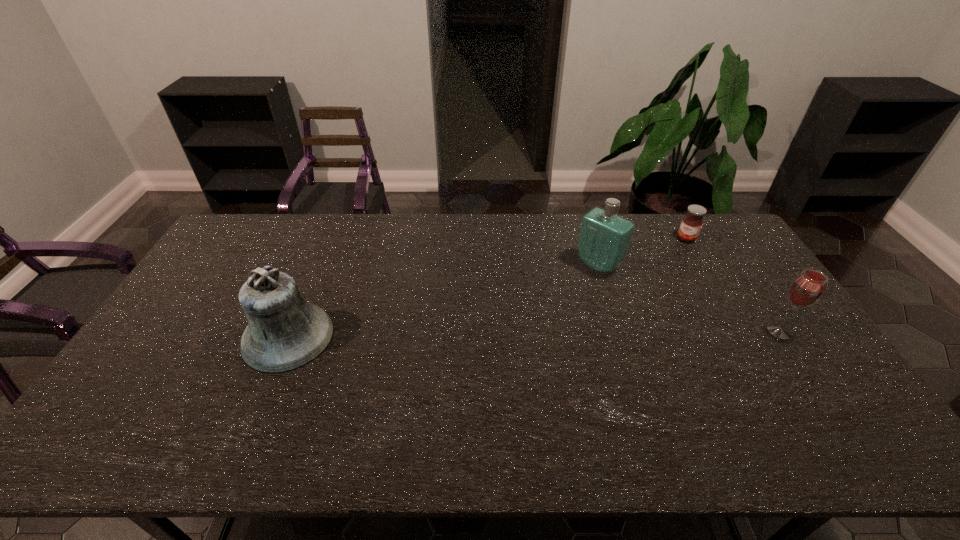
This screenshot has width=960, height=540. Find the location of `vacant space at the far edge of the desktop`. vacant space at the far edge of the desktop is located at coordinates (382, 233).

You are a GUI agent. You are given a task and a screenshot of the screen. Output one action in this format:
    pyautogui.click(x=<x>, y=<y>)
    Task: Click on the free location at the near edge of the desktop
    The width and height of the screenshot is (960, 540).
    Given the screenshot: What is the action you would take?
    pyautogui.click(x=469, y=408)

Image resolution: width=960 pixels, height=540 pixels. Identify the location of vacant space at the left edge of the desktop. (183, 360).

I want to click on free space at the far left corner, so click(232, 247).

In the image, there is a desktop. At what (x,y) coordinates should I click in order to perform the action: click on blank space at the near left corner. Please return your answer as a coordinate pair (x, y). This screenshot has width=960, height=540. Looking at the image, I should click on (156, 388).

In the image, there is a desktop. Where is `vacant space at the far right corner`? vacant space at the far right corner is located at coordinates (706, 230).

Where is `vacant space in between the shortest object and the bell`? The image size is (960, 540). vacant space in between the shortest object and the bell is located at coordinates (487, 288).

I want to click on free point between the bell and the farthest object, so click(x=487, y=288).

You are a GUI agent. You are given a task and a screenshot of the screen. Output one action in this format:
    pyautogui.click(x=<x>, y=<y>)
    Task: Click on the empty space that is in between the wineglass and the second object from left to right
    This screenshot has width=960, height=540.
    Given the screenshot: What is the action you would take?
    pyautogui.click(x=689, y=298)

Identify the location of free spot between the wineglass and the leftmost object. The image size is (960, 540). (534, 334).